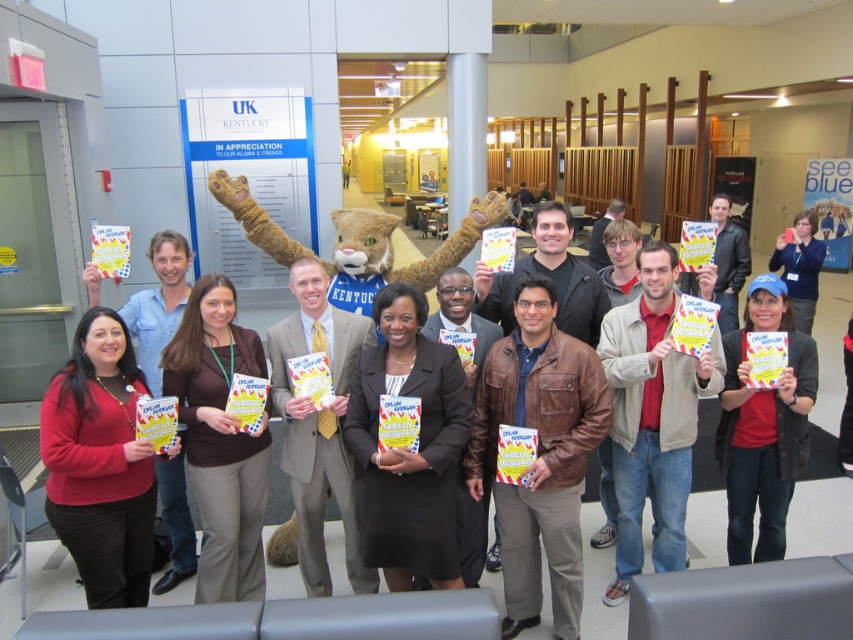
Question: Does matte red sweater at lower left have a smaller size compared to matte blue cap at center?

Choices:
 (A) no
 (B) yes

Answer: (B)

Question: Can you confirm if furry plush at center is smaller than matte red sweater at lower left?

Choices:
 (A) yes
 (B) no

Answer: (B)

Question: Where is furry plush at center located in relation to matte blue cap at center in the image?

Choices:
 (A) above
 (B) below

Answer: (B)

Question: Which of the following is the closest to the observer?

Choices:
 (A) furry plush at center
 (B) matte red sweater at lower left

Answer: (B)

Question: Which point appears farthest from the camera in this image?

Choices:
 (A) pyautogui.click(x=363, y=314)
 (B) pyautogui.click(x=170, y=324)
 (C) pyautogui.click(x=798, y=234)

Answer: (C)

Question: Based on their relative distances, which object is nearer to the matte blue cap at center?

Choices:
 (A) matte red sweater at lower left
 (B) furry plush at center

Answer: (B)